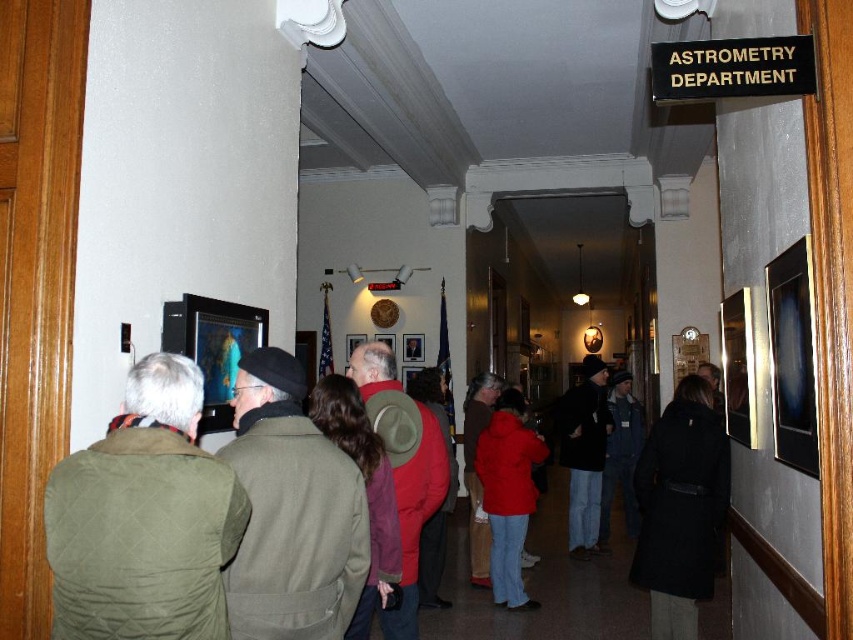
Question: Which point appears farthest from the camera in this image?

Choices:
 (A) (323, 637)
 (B) (514, 550)
 (C) (68, 460)
 (D) (703, 545)

Answer: (B)

Question: Can you confirm if red wool coat at center is positioned below denim jacket at center?

Choices:
 (A) no
 (B) yes

Answer: (A)

Question: Which object is the farthest from the matte red jacket at center?

Choices:
 (A) black wool coat at lower right
 (B) green quilted jacket at left
 (C) matte black jacket at center

Answer: (B)

Question: Which of the following is the farthest from the observer?

Choices:
 (A) denim jacket at center
 (B) green quilted jacket at left
 (C) red woolen hat at center
 (D) green wool coat at center

Answer: (A)

Question: Where is green quilted jacket at left located in relation to black wool coat at lower right in the image?

Choices:
 (A) below
 (B) above

Answer: (B)

Question: Is green wool coat at center closer to camera compared to denim jacket at center?

Choices:
 (A) yes
 (B) no

Answer: (A)